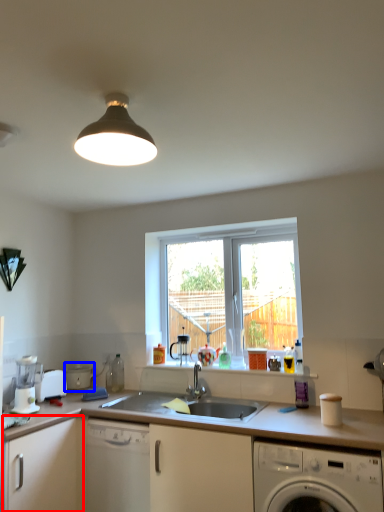
Question: Which object appears closest to the camera in this image, cabinetry (highlighted by a red box) or appliance (highlighted by a blue box)?

Choices:
 (A) cabinetry
 (B) appliance

Answer: (A)